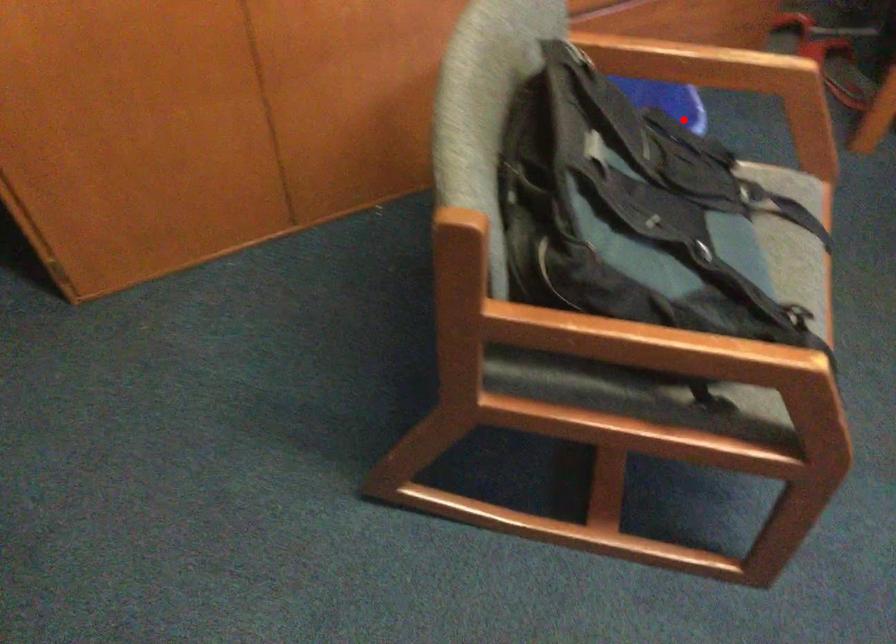
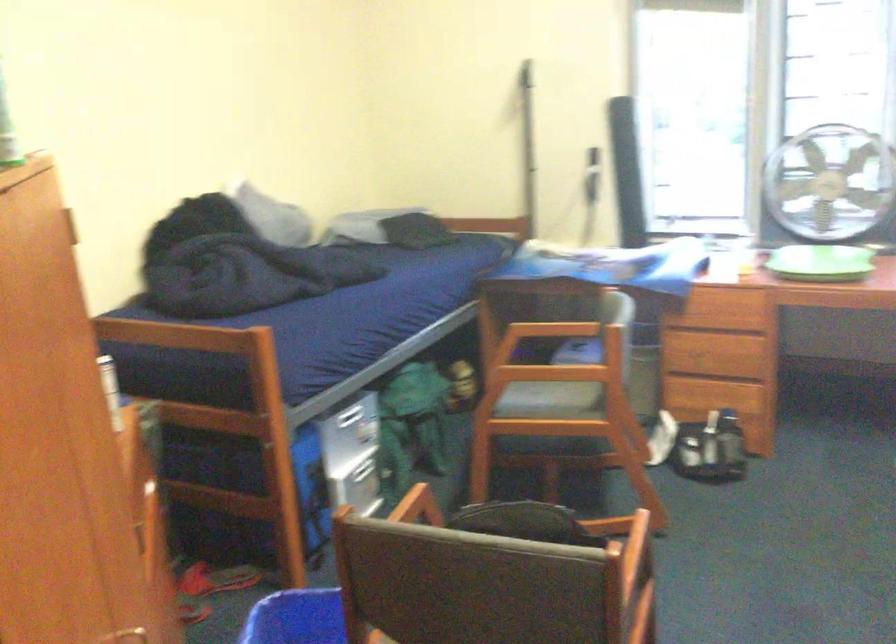
Find the pixel in the second image that matches the highlighted location in the first image.

(297, 618)